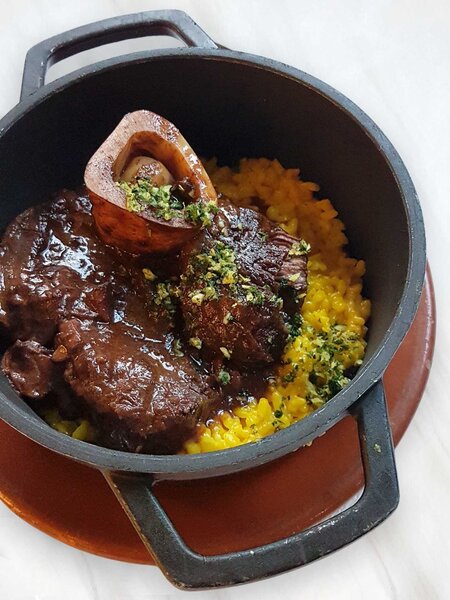
Where is `pot handles`? Image resolution: width=450 pixels, height=600 pixels. pot handles is located at coordinates (84, 31), (285, 548).